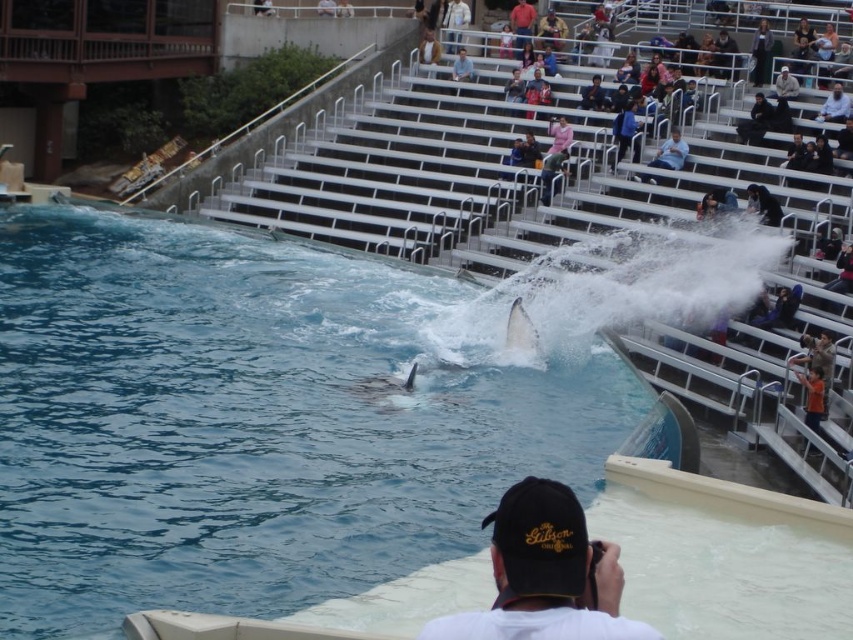
You are a photographer at the marine show. You notice the clear blue water at center and the black fabric cap at lower center in your viewfinder. Which object is positioned higher in the frame?

The clear blue water at center is located above the black fabric cap at lower center, so it is positioned higher in the frame.

Looking at this image, you are a photographer at the marine show. You have to decide whether your camera can capture both the clear blue water at center and the black leather jacket at upper center in one shot. The camera can only focus on objects within the same height range. Can you do it?

The clear blue water at center is taller than the black leather jacket at upper center. Since the camera requires objects to be within the same height range to focus, you cannot capture both in one shot because their heights differ.